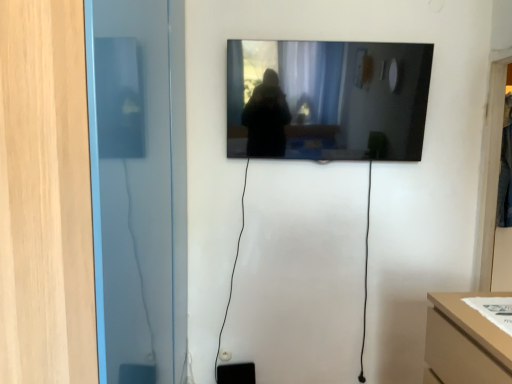
Question: Is black glossy mirror at upper center at the left side of transparent glass door at right, marked as the 1th glass door in a right-to-left arrangement?

Choices:
 (A) no
 (B) yes

Answer: (B)

Question: Is black glossy mirror at upper center to the right of transparent glass door at right, acting as the first glass door starting from the back, from the viewer's perspective?

Choices:
 (A) no
 (B) yes

Answer: (A)

Question: From the image's perspective, is black glossy mirror at upper center under transparent glass door at right, the 2th glass door viewed from the left?

Choices:
 (A) yes
 (B) no

Answer: (B)

Question: Is black glossy mirror at upper center beside transparent glass door at right, which is counted as the second glass door, starting from the front?

Choices:
 (A) no
 (B) yes

Answer: (A)

Question: From a real-world perspective, is black glossy mirror at upper center on top of transparent glass door at right, the 2th glass door viewed from the left?

Choices:
 (A) yes
 (B) no

Answer: (A)

Question: Can you confirm if black glossy mirror at upper center is thinner than transparent glass door at right, which is counted as the second glass door, starting from the front?

Choices:
 (A) no
 (B) yes

Answer: (A)

Question: Is transparent glass door at right, marked as the 1th glass door in a right-to-left arrangement, positioned behind black glossy mirror at upper center?

Choices:
 (A) yes
 (B) no

Answer: (A)

Question: From a real-world perspective, is transparent glass door at right, marked as the 1th glass door in a right-to-left arrangement, under black glossy mirror at upper center?

Choices:
 (A) yes
 (B) no

Answer: (A)

Question: Is transparent glass door at right, marked as the 1th glass door in a right-to-left arrangement, completely or partially outside of black glossy mirror at upper center?

Choices:
 (A) no
 (B) yes

Answer: (B)

Question: Considering the relative sizes of transparent glass door at right, the 2th glass door viewed from the left, and black glossy mirror at upper center in the image provided, is transparent glass door at right, the 2th glass door viewed from the left, taller than black glossy mirror at upper center?

Choices:
 (A) no
 (B) yes

Answer: (B)

Question: Is transparent glass door at right, the 2th glass door viewed from the left, shorter than black glossy mirror at upper center?

Choices:
 (A) no
 (B) yes

Answer: (A)

Question: Can you confirm if transparent glass door at right, which is counted as the second glass door, starting from the front, is bigger than black glossy mirror at upper center?

Choices:
 (A) yes
 (B) no

Answer: (B)

Question: From a real-world perspective, is transparent glass door at left, which is counted as the second glass door, starting from the back, located beneath black glossy mirror at upper center?

Choices:
 (A) no
 (B) yes

Answer: (B)